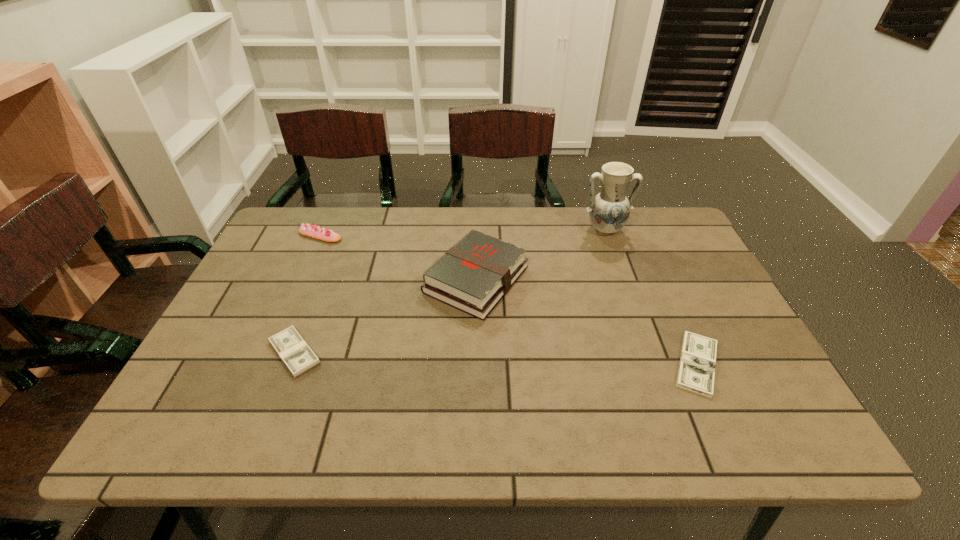
At what (x,y) coordinates should I click in order to perform the action: click on vacant area that lies between the third farthest object and the tallest object. Please return your answer as a coordinate pair (x, y). This screenshot has height=540, width=960. Looking at the image, I should click on (540, 255).

This screenshot has height=540, width=960. Identify the location of empty space that is in between the left dollar and the eclair. click(307, 294).

Image resolution: width=960 pixels, height=540 pixels. Identify the location of free spot between the fourth tallest object and the eclair. (307, 294).

Image resolution: width=960 pixels, height=540 pixels. What are the coordinates of `vacant space that is in between the tallest object and the eclair` in the screenshot? It's located at (463, 233).

The image size is (960, 540). Find the location of `empty location between the shortest object and the tallest object`. empty location between the shortest object and the tallest object is located at coordinates (651, 297).

Identify the location of vacant area that lies between the shortest object and the second shortest object. (495, 358).

The width and height of the screenshot is (960, 540). What are the coordinates of `free space between the hardback book and the shortest object` in the screenshot? It's located at (587, 322).

Identify the location of free area in between the shortest object and the third shortest object. (509, 300).

The width and height of the screenshot is (960, 540). What are the coordinates of `object that stands as the fourth closest to the taller dollar` in the screenshot? It's located at (696, 373).

Choose which object is the second nearest neighbor to the eclair. Please provide its 2D coordinates. Your answer should be formatted as a tuple, i.e. [(x, y)], where the tuple contains the x and y coordinates of a point satisfying the conditions above.

[(298, 357)]